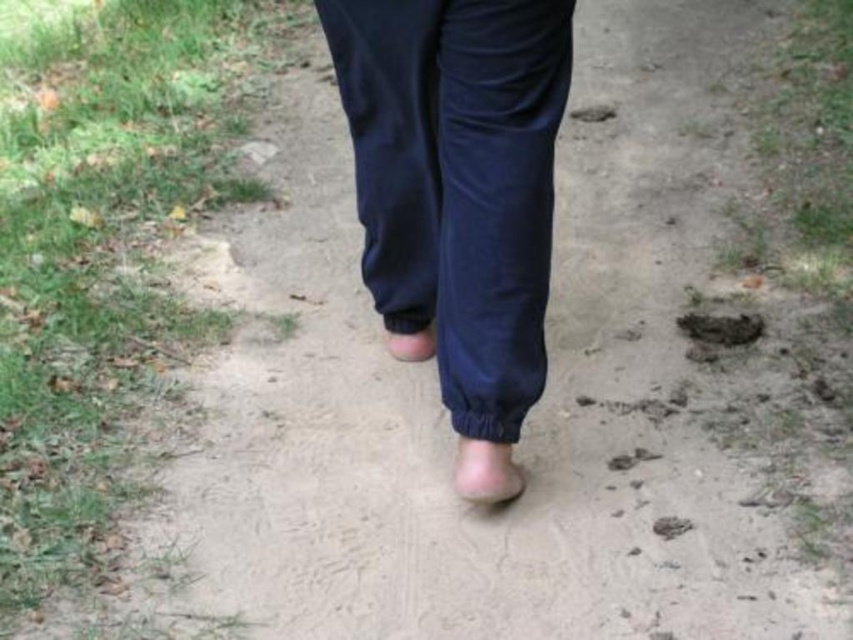
You are a hiker who wants to check if your pink matte foot at center can fit into the brown dirt footprint at lower right. Based on their sizes, is this possible?

The pink matte foot at center is bigger than the brown dirt footprint at lower right, so it cannot fit into it.

You are a forensic analyst examining the scene. The person left a footprint on the brown dirt at center. How does the size of the person wearing the matte skin foot at center compare to the brown dirt footprint at center?

The matte skin foot at center is smaller than the brown dirt footprint at center, which means the person wearing the matte skin foot at center has a smaller foot than the footprint left on the brown dirt at center.